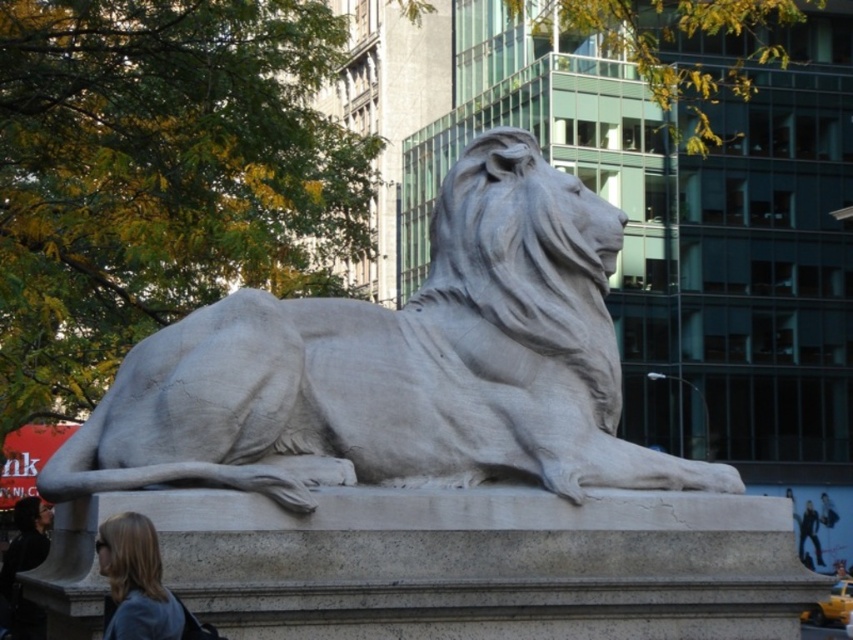
What do you see at coordinates (399, 365) in the screenshot? The image size is (853, 640). I see `white stone lion at center` at bounding box center [399, 365].

Does white stone lion at center appear over blonde hair at lower left?

Indeed, white stone lion at center is positioned over blonde hair at lower left.

Does point (589, 246) come closer to viewer compared to point (148, 600)?

No, it is not.

Identify the location of white stone lion at center. This screenshot has height=640, width=853. [399, 365].